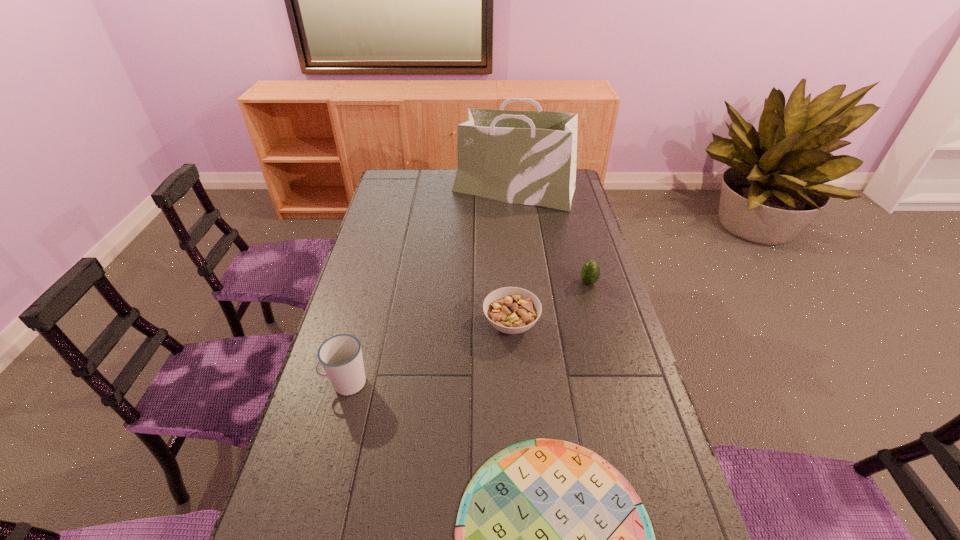
Find the location of a particular element. This screenshot has height=540, width=960. empty location between the cup and the third tallest object is located at coordinates (468, 333).

The height and width of the screenshot is (540, 960). I want to click on free space between the tallest object and the fourth nearest object, so click(x=551, y=236).

What are the coordinates of `vacant space that's between the fourth farthest object and the stew` in the screenshot? It's located at (429, 354).

Where is `empty space that is in between the grocery bag and the fourth farthest object`? This screenshot has width=960, height=540. empty space that is in between the grocery bag and the fourth farthest object is located at coordinates 430,287.

Where is `empty location between the farthest object and the stew`? empty location between the farthest object and the stew is located at coordinates (513, 257).

Where is `free spot between the second tallest object and the grocery bag`? Image resolution: width=960 pixels, height=540 pixels. free spot between the second tallest object and the grocery bag is located at coordinates (430, 287).

Locate which object ranks fourth in proximity to the fourth farthest object. Please provide its 2D coordinates. Your answer should be formatted as a tuple, i.e. [(x, y)], where the tuple contains the x and y coordinates of a point satisfying the conditions above.

[(523, 157)]

Identify which object is the third closest to the second farthest object. Please provide its 2D coordinates. Your answer should be formatted as a tuple, i.e. [(x, y)], where the tuple contains the x and y coordinates of a point satisfying the conditions above.

[(550, 539)]

What are the coordinates of `free space in the image that satisfies the following two spatial constraints: 1. on the front side of the second farthest object; 2. with a handle on the side of the cup` in the screenshot? It's located at (616, 383).

This screenshot has height=540, width=960. I want to click on vacant region that satisfies the following two spatial constraints: 1. on the front side of the stew; 2. with a handle on the side of the second tallest object, so click(x=516, y=383).